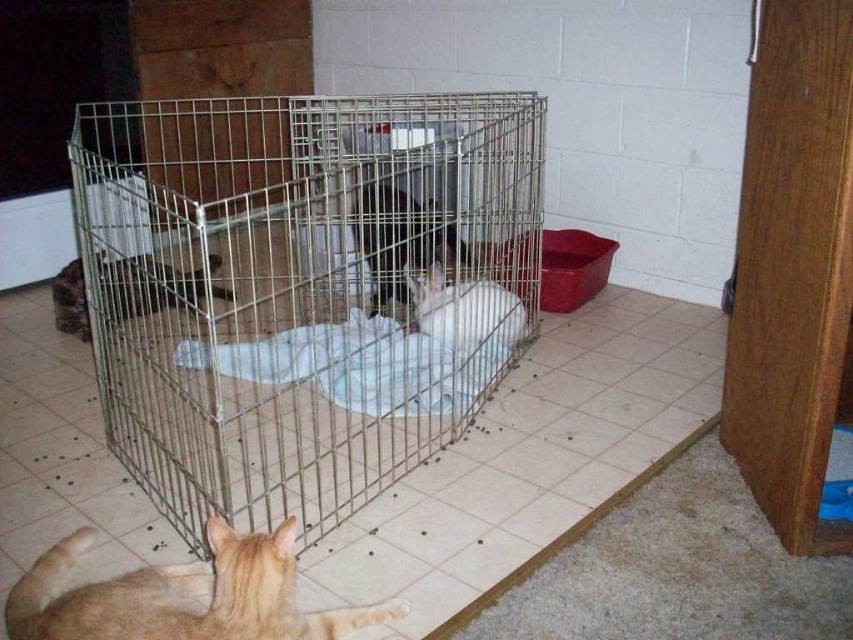
You are an animal caretaker who needs to check on the animals in the cage. You see the brown fur cat at center and the fluffy brown cat at center. Which one is positioned higher in the image?

The brown fur cat at center is located above the fluffy brown cat at center, so it is positioned higher in the image.

You are a pet owner who wants to place a new cat bed for your orange fur cat at lower left. The current metal wire cage at center is where your rabbit lives. Considering the size of both, which animal has more space available in their respective areas?

The metal wire cage at center is larger in size than the orange fur cat at lower left, so the rabbit has more space available in its cage compared to the cat.

You are a cat owner who wants to place a new cat bed for your orange fur cat at lower left. The bed requires a space of 0.2 meters in width. The cage is located at point (183, 595). Can the bed fit in the cage?

The orange fur cat at lower left is located at point (183, 595). The cage has vertical bars forming its structure, but the description does not specify the cage dimensions. Therefore, it is unclear if the bed will fit. Please check the cage size before placing the bed.